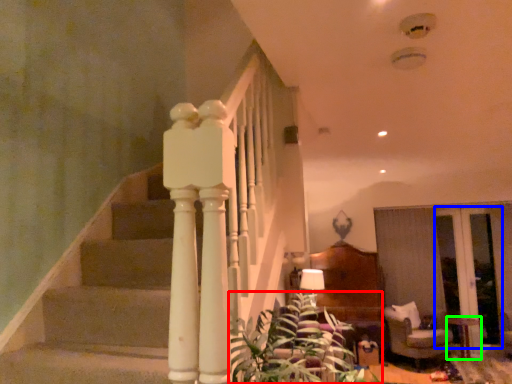
Question: Considering the real-world distances, which object is farthest from plant (highlighted by a red box)? glass door (highlighted by a blue box) or table (highlighted by a green box)?

Choices:
 (A) glass door
 (B) table

Answer: (A)